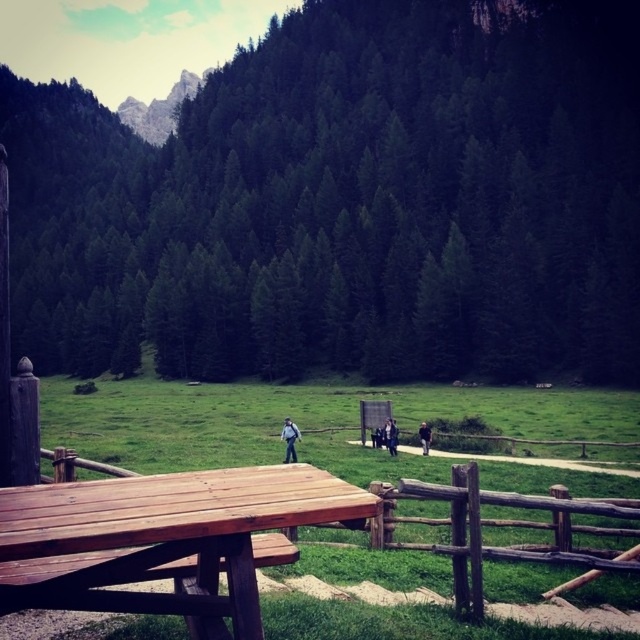
Question: Which of the following is the closest to the observer?

Choices:
 (A) dark blue fabric jacket at center
 (B) light brown leather jacket at center
 (C) dark blue jeans at center

Answer: (C)

Question: Does dark blue jeans at center lie in front of dark blue fabric jacket at center?

Choices:
 (A) no
 (B) yes

Answer: (B)

Question: Does dark blue fabric jacket at center have a lesser width compared to light brown leather jacket at center?

Choices:
 (A) no
 (B) yes

Answer: (A)

Question: Which point appears farthest from the camera in this image?

Choices:
 (A) (385, 428)
 (B) (292, 452)
 (C) (150, 100)

Answer: (C)

Question: Which point is closer to the camera?

Choices:
 (A) 150,106
 (B) 285,449
 (C) 204,513
 (D) 384,432

Answer: (C)

Question: Is rugged stone mountain at upper left to the left of dark blue jeans at center from the viewer's perspective?

Choices:
 (A) no
 (B) yes

Answer: (B)